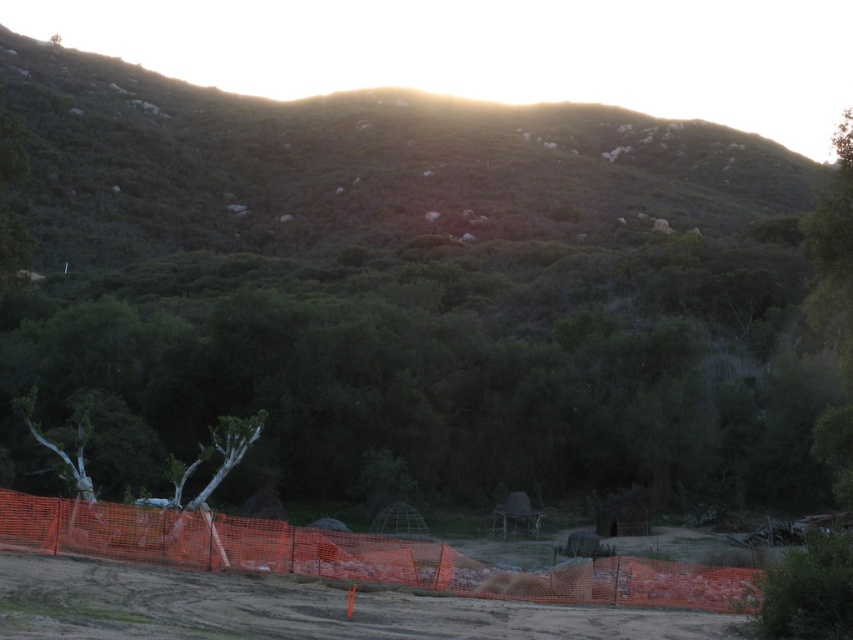
Can you confirm if green leafy hillside at upper center is smaller than orange mesh fence at lower center?

Actually, green leafy hillside at upper center might be larger than orange mesh fence at lower center.

Does green leafy hillside at upper center appear under orange mesh fence at lower center?

No, green leafy hillside at upper center is not below orange mesh fence at lower center.

In order to click on green leafy hillside at upper center in this screenshot , I will do `click(352, 164)`.

The width and height of the screenshot is (853, 640). In order to click on green leafy hillside at upper center in this screenshot , I will do `click(352, 164)`.

Between point (706, 637) and point (753, 580), which one is positioned in front?

Point (706, 637)

Is dirt track at lower center positioned behind orange mesh fence at lower center?

No, dirt track at lower center is in front of orange mesh fence at lower center.

Find the location of a particular element. The image size is (853, 640). dirt track at lower center is located at coordinates (294, 609).

Is green leafy hillside at upper center smaller than dirt track at lower center?

No.

Is point (492, 157) positioned in front of point (228, 577)?

No, it is not.

The image size is (853, 640). In order to click on green leafy hillside at upper center in this screenshot , I will do `click(352, 164)`.